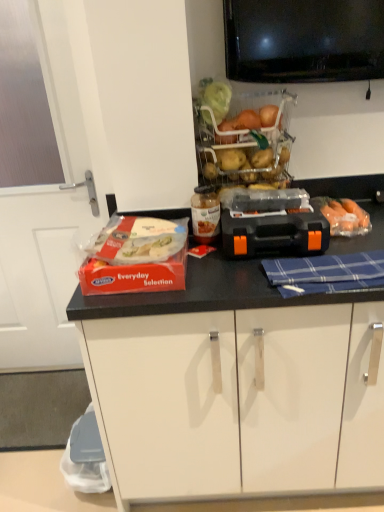
Question: Would you say translucent plastic basket at upper center contains black plastic toolbox at center?

Choices:
 (A) no
 (B) yes

Answer: (A)

Question: Does translucent plastic basket at upper center have a lesser width compared to black plastic toolbox at center?

Choices:
 (A) no
 (B) yes

Answer: (B)

Question: Is translucent plastic basket at upper center at the right side of black plastic toolbox at center?

Choices:
 (A) no
 (B) yes

Answer: (A)

Question: Is translucent plastic basket at upper center to the left of black plastic toolbox at center from the viewer's perspective?

Choices:
 (A) yes
 (B) no

Answer: (A)

Question: Considering the relative sizes of translucent plastic basket at upper center and black plastic toolbox at center in the image provided, is translucent plastic basket at upper center bigger than black plastic toolbox at center?

Choices:
 (A) yes
 (B) no

Answer: (A)

Question: Choose the correct answer: Is white glossy door at left inside translucent plastic basket at upper center or outside it?

Choices:
 (A) outside
 (B) inside

Answer: (A)

Question: Considering their positions, is white glossy door at left located in front of or behind translucent plastic basket at upper center?

Choices:
 (A) front
 (B) behind

Answer: (B)

Question: In terms of width, does white glossy door at left look wider or thinner when compared to translucent plastic basket at upper center?

Choices:
 (A) wide
 (B) thin

Answer: (B)

Question: From the image's perspective, relative to translucent plastic basket at upper center, is white glossy door at left above or below?

Choices:
 (A) above
 (B) below

Answer: (B)

Question: Is point (130, 218) closer or farther from the camera than point (13, 268)?

Choices:
 (A) closer
 (B) farther

Answer: (A)

Question: Considering their positions, is translucent plastic food at center left, which appears as the 2th food when viewed from the right, located in front of or behind white glossy door at left?

Choices:
 (A) behind
 (B) front

Answer: (B)

Question: Considering the relative positions of translucent plastic food at center left, which appears as the 2th food when viewed from the right, and white glossy door at left in the image provided, is translucent plastic food at center left, which appears as the 2th food when viewed from the right, to the left or to the right of white glossy door at left?

Choices:
 (A) left
 (B) right

Answer: (B)

Question: Do you think translucent plastic food at center left, marked as the 1th food in a left-to-right arrangement, is within white glossy door at left, or outside of it?

Choices:
 (A) outside
 (B) inside

Answer: (A)

Question: In terms of size, does black plastic toolbox at center appear bigger or smaller than blue plaid cloth at center?

Choices:
 (A) big
 (B) small

Answer: (A)

Question: From their relative heights in the image, would you say black plastic toolbox at center is taller or shorter than blue plaid cloth at center?

Choices:
 (A) short
 (B) tall

Answer: (B)